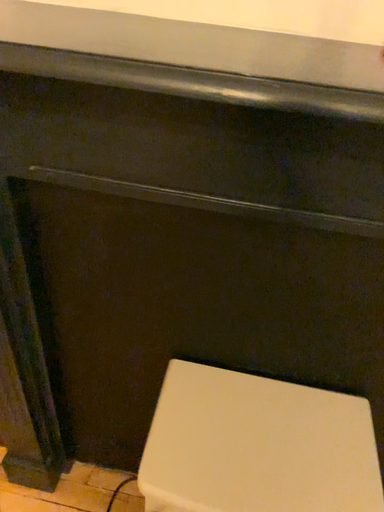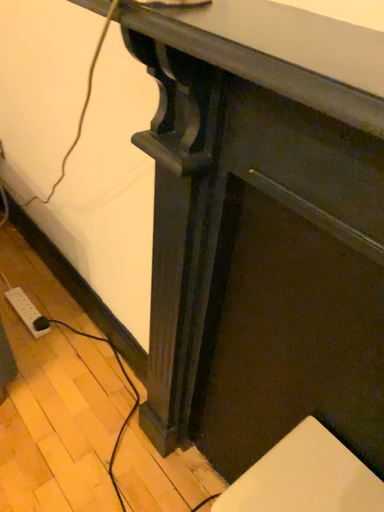
Question: How did the camera likely rotate when shooting the video?

Choices:
 (A) rotated right
 (B) rotated left

Answer: (B)